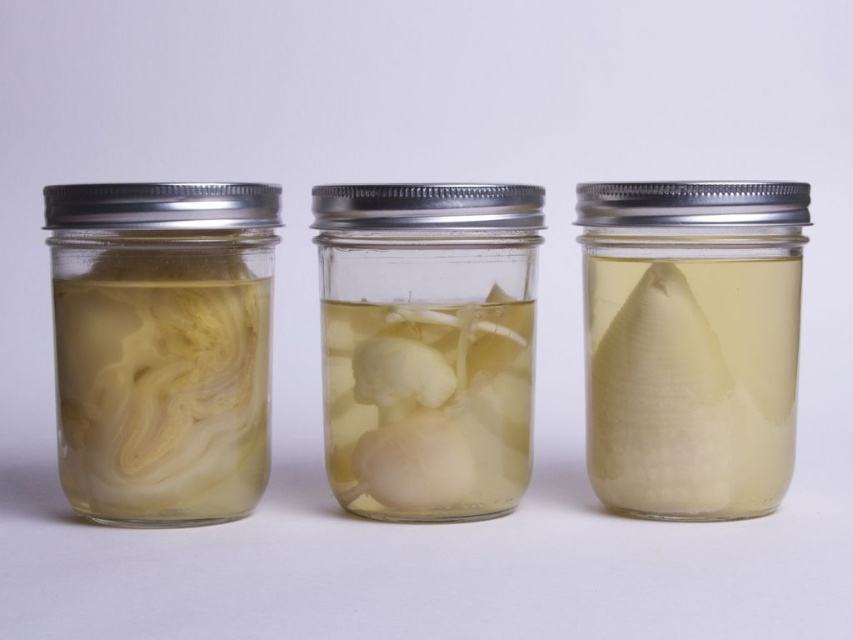
Question: Does translucent glass cone at center lie behind white glossy noodles at left?

Choices:
 (A) yes
 (B) no

Answer: (A)

Question: Which point is farther from the camera taking this photo?

Choices:
 (A) (105, 253)
 (B) (642, 228)

Answer: (B)

Question: Among these objects, which one is nearest to the camera?

Choices:
 (A) translucent white mushrooms at center
 (B) white glossy noodles at left

Answer: (B)

Question: Which object is closer to the camera taking this photo?

Choices:
 (A) translucent glass cone at center
 (B) translucent white mushrooms at center
 (C) white glossy noodles at left

Answer: (C)

Question: Can you confirm if translucent glass cone at center is wider than white glossy noodles at left?

Choices:
 (A) yes
 (B) no

Answer: (A)

Question: Is white glossy noodles at left positioned before translucent white mushrooms at center?

Choices:
 (A) no
 (B) yes

Answer: (B)